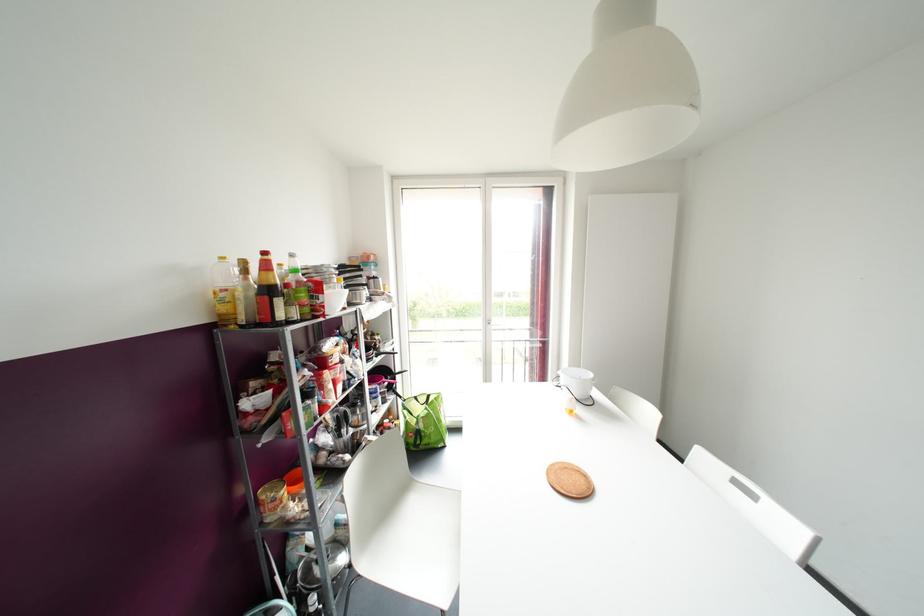
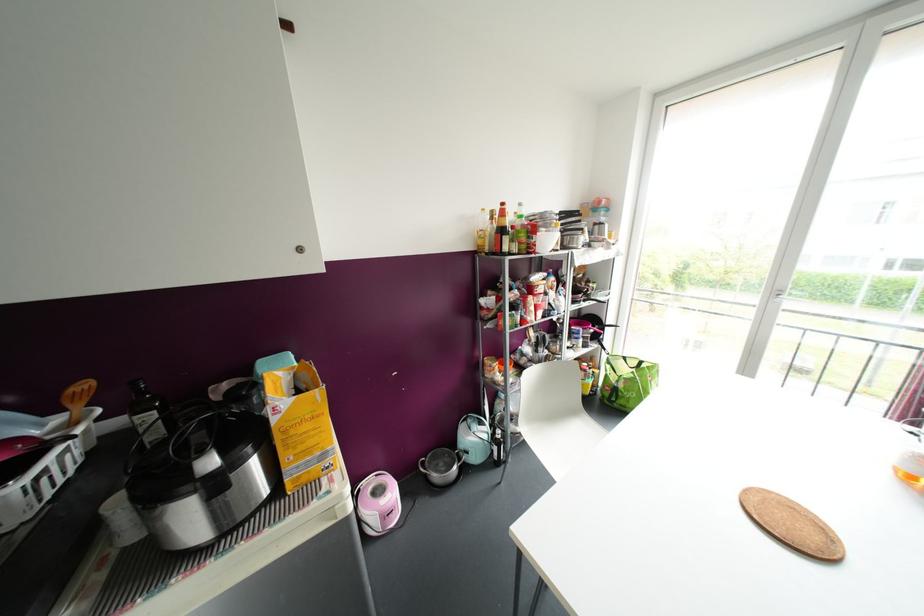
In the second image, find the point that corresponds to [264,253] in the first image.

(502, 204)